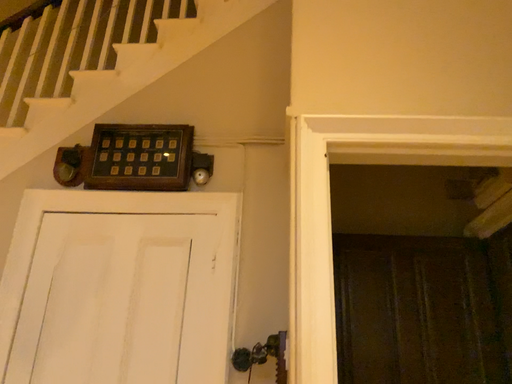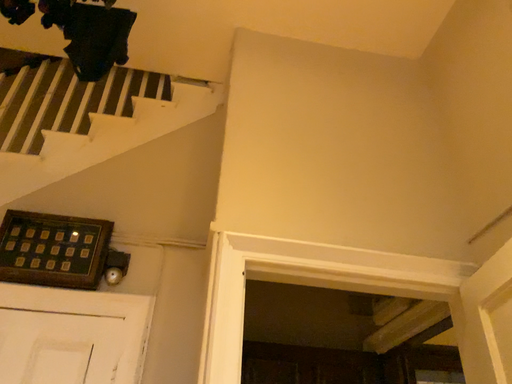
Question: Which way did the camera rotate in the video?

Choices:
 (A) rotated left
 (B) rotated right

Answer: (B)